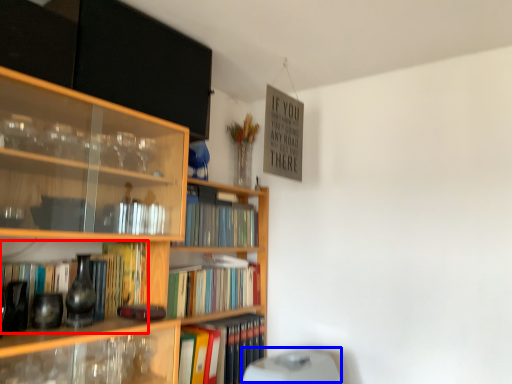
Question: Which object is closer to the camera taking this photo, book (highlighted by a red box) or water heater (highlighted by a blue box)?

Choices:
 (A) book
 (B) water heater

Answer: (A)